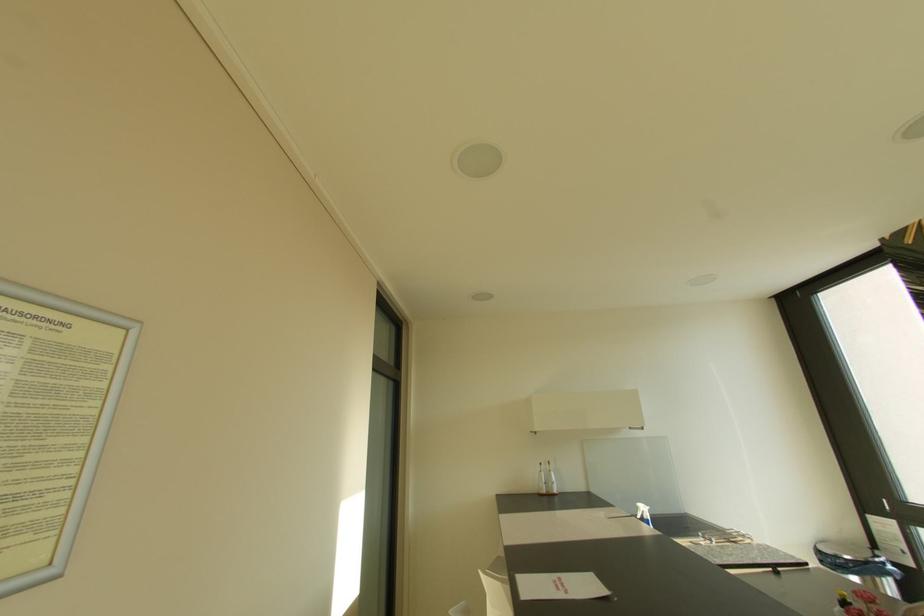
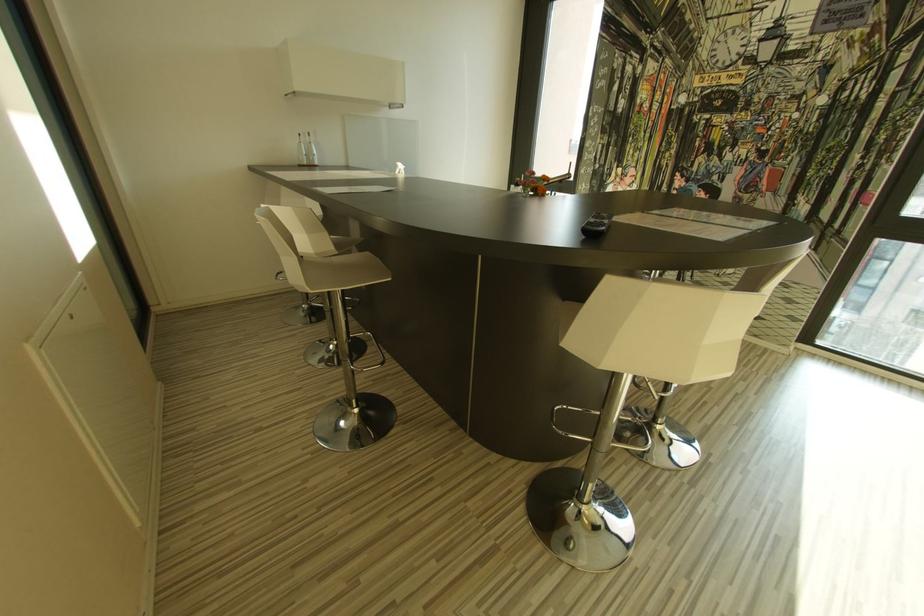
The first image is from the beginning of the video and the second image is from the end. How did the camera likely rotate when shooting the video?

The rotation direction of the camera is right-down.